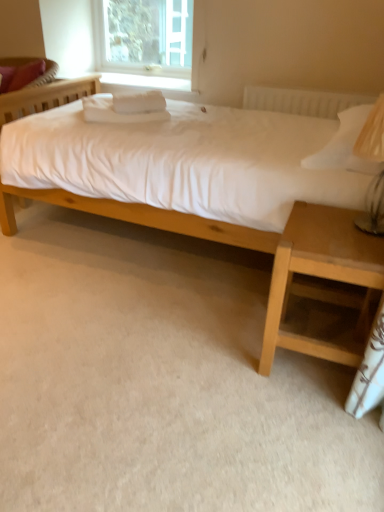
Question: Is clear glass window at upper center further to camera compared to light brown wood nightstand at lower right?

Choices:
 (A) no
 (B) yes

Answer: (B)

Question: Can you confirm if clear glass window at upper center is smaller than light brown wood nightstand at lower right?

Choices:
 (A) yes
 (B) no

Answer: (A)

Question: Could you tell me if clear glass window at upper center is turned towards light brown wood nightstand at lower right?

Choices:
 (A) yes
 (B) no

Answer: (B)

Question: Can you confirm if clear glass window at upper center is shorter than light brown wood nightstand at lower right?

Choices:
 (A) yes
 (B) no

Answer: (A)

Question: Is clear glass window at upper center thinner than light brown wood nightstand at lower right?

Choices:
 (A) no
 (B) yes

Answer: (B)

Question: Is clear glass window at upper center taller than light brown wood nightstand at lower right?

Choices:
 (A) no
 (B) yes

Answer: (A)

Question: Can you confirm if clear glass window at upper center is thinner than matte pink pillow at upper left?

Choices:
 (A) no
 (B) yes

Answer: (B)

Question: Is clear glass window at upper center far away from matte pink pillow at upper left?

Choices:
 (A) yes
 (B) no

Answer: (B)

Question: Can you confirm if clear glass window at upper center is shorter than matte pink pillow at upper left?

Choices:
 (A) no
 (B) yes

Answer: (A)

Question: Is clear glass window at upper center behind matte pink pillow at upper left?

Choices:
 (A) yes
 (B) no

Answer: (A)

Question: From a real-world perspective, is clear glass window at upper center physically above matte pink pillow at upper left?

Choices:
 (A) no
 (B) yes

Answer: (B)

Question: From a real-world perspective, is clear glass window at upper center located beneath matte pink pillow at upper left?

Choices:
 (A) yes
 (B) no

Answer: (B)

Question: Is clear glass window at upper center aimed at matte wood bed at center?

Choices:
 (A) no
 (B) yes

Answer: (B)